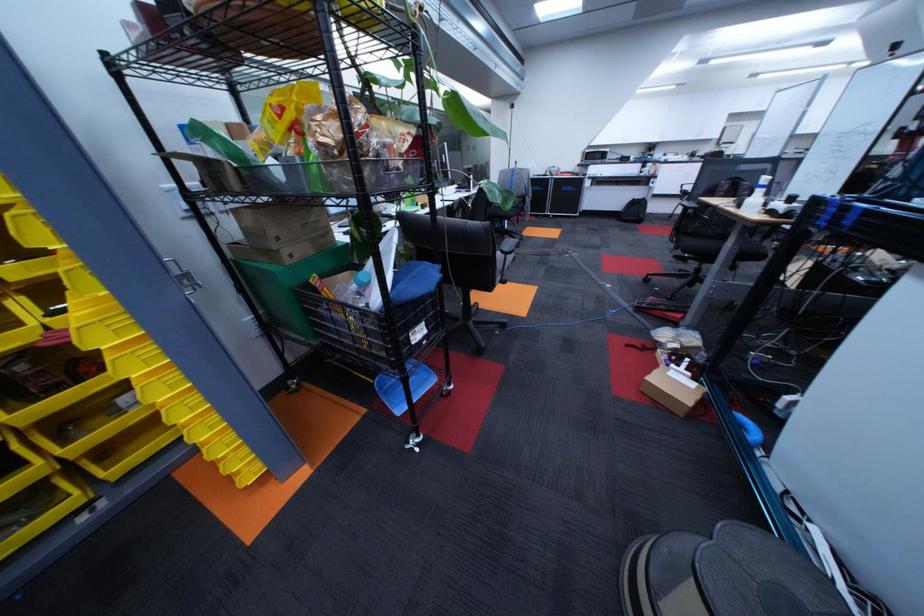
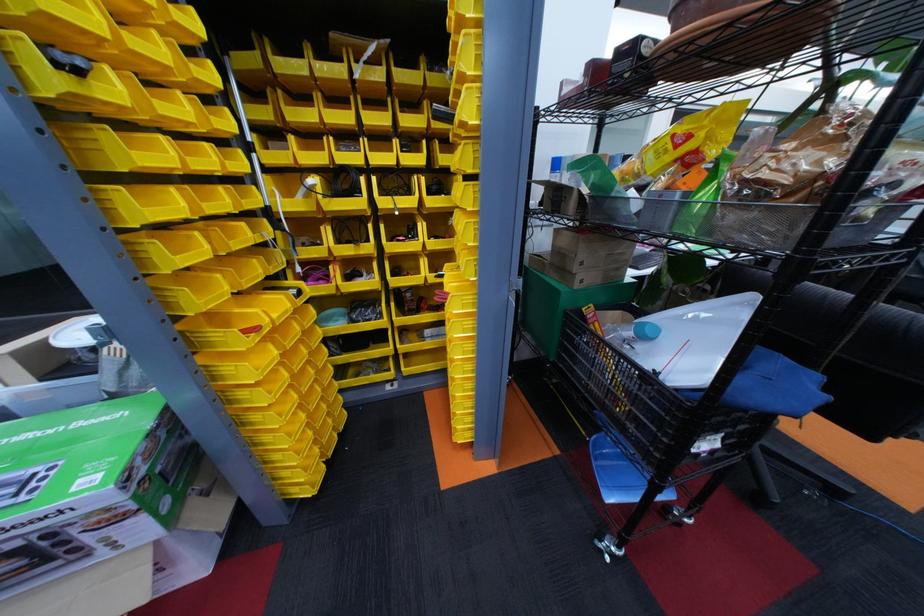
Find the pixel in the second image that matches point 301,262 in the first image.

(590, 286)